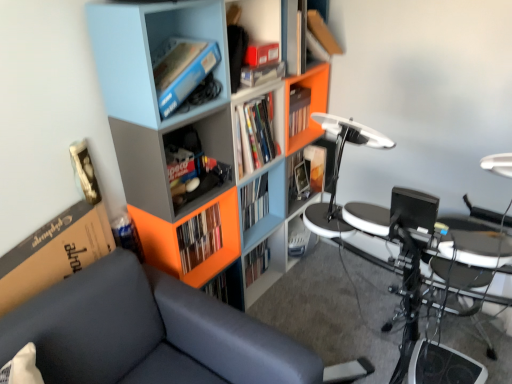
Question: Considering the positions of matte blue bookshelf at upper left, which is the second shelf from bottom to top, and matte plastic book at center, acting as the second book starting from the front, in the image, is matte blue bookshelf at upper left, which is the second shelf from bottom to top, wider or thinner than matte plastic book at center, acting as the second book starting from the front,?

Choices:
 (A) thin
 (B) wide

Answer: (B)

Question: Based on their sizes in the image, would you say matte blue bookshelf at upper left, which is the second shelf in top-to-bottom order, is bigger or smaller than matte plastic book at center, which appears as the 1th book when viewed from the right?

Choices:
 (A) big
 (B) small

Answer: (A)

Question: Considering the real-world distances, which object is closest to the matte plastic shelf at center, which ranks as the 3th shelf in top-to-bottom order?

Choices:
 (A) matte plastic cabinet at center
 (B) metallic silver drum set at lower right
 (C) matte plastic book at center, which is the second book in bottom-to-top order
 (D) orange matte bookshelf at center, the 1th book positioned from the front
 (E) dark gray fabric couch at left

Answer: (D)

Question: Based on their relative distances, which object is nearer to the matte plastic cabinet at center?

Choices:
 (A) matte plastic shelf at center, the 1th shelf positioned from the bottom
 (B) matte blue bookshelf at upper left, which is the second shelf in top-to-bottom order
 (C) metallic silver drum set at lower right
 (D) matte plastic book at center, which is the first book from top to bottom
 (E) dark gray fabric couch at left

Answer: (D)